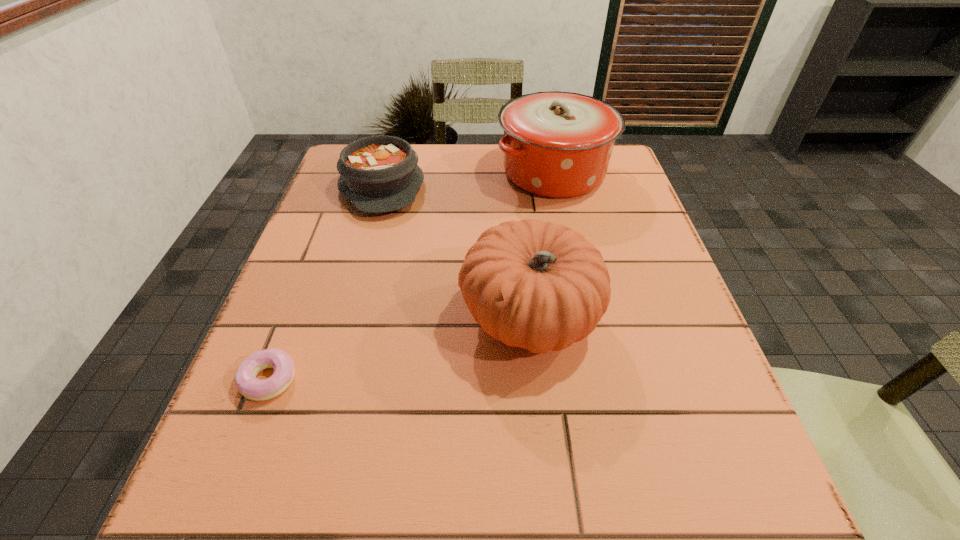
Where is `vacant point located between the shortest object and the left casserole`? vacant point located between the shortest object and the left casserole is located at coordinates (325, 283).

Locate an element on the screen. The height and width of the screenshot is (540, 960). vacant region between the pumpkin and the shortest object is located at coordinates pos(399,349).

This screenshot has height=540, width=960. Find the location of `blank region between the right casserole and the second shortest object`. blank region between the right casserole and the second shortest object is located at coordinates (468, 179).

Identify the location of blank region between the shortest object and the taller casserole. (412, 276).

The height and width of the screenshot is (540, 960). Identify the location of empty location between the pumpkin and the shortest object. (399, 349).

Find the location of a particular element. The height and width of the screenshot is (540, 960). vacant point located between the shortest object and the taller casserole is located at coordinates (412, 276).

Locate an element on the screen. Image resolution: width=960 pixels, height=540 pixels. object that can be found as the third closest to the pumpkin is located at coordinates (247, 384).

The height and width of the screenshot is (540, 960). What are the coordinates of `object identified as the second closest to the pumpkin` in the screenshot? It's located at (556, 144).